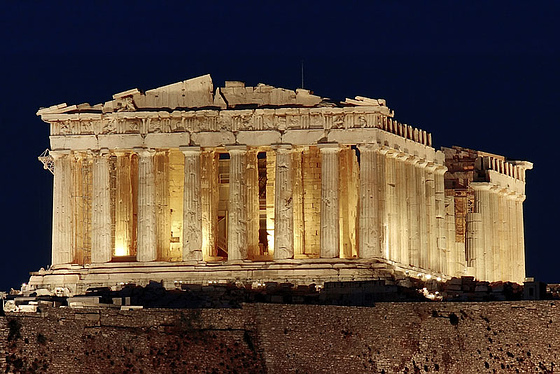
Locate an element on the screen. The image size is (560, 374). lights is located at coordinates (265, 232), (129, 243).